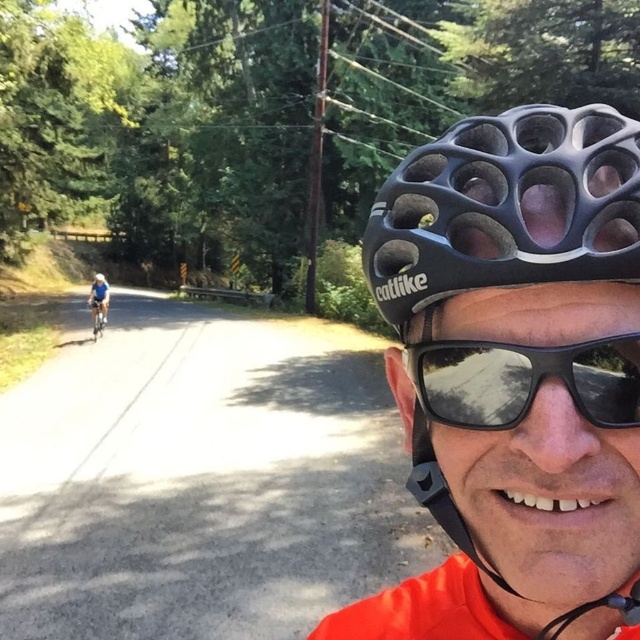
Is point (520, 417) closer to viewer compared to point (102, 280)?

Yes, it is in front of point (102, 280).

I want to click on black reflective sunglasses at center, so click(524, 380).

Who is more distant from viewer, (504,376) or (99,280)?

Point (99,280)

Where is `black reflective sunglasses at center`? Image resolution: width=640 pixels, height=640 pixels. black reflective sunglasses at center is located at coordinates pyautogui.click(x=524, y=380).

Between black matte bicycle helmet at center and matte black helmet at center, which one has more height?

Standing taller between the two is matte black helmet at center.

Which is behind, point (600, 228) or point (97, 278)?

The point (97, 278) is behind.

This screenshot has height=640, width=640. Find the location of `black matte bicycle helmet at center`. black matte bicycle helmet at center is located at coordinates (506, 275).

Does silver metallic bicycle at center have a larger size compared to matte black helmet at center?

Incorrect, silver metallic bicycle at center is not larger than matte black helmet at center.

Where is `silver metallic bicycle at center`? This screenshot has height=640, width=640. silver metallic bicycle at center is located at coordinates (97, 316).

Find the location of a particular element. This screenshot has height=640, width=640. silver metallic bicycle at center is located at coordinates (97, 316).